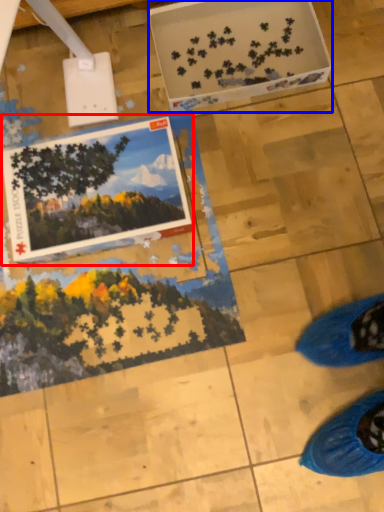
Question: Which object is further to the camera taking this photo, postcard (highlighted by a red box) or cardboard box (highlighted by a blue box)?

Choices:
 (A) postcard
 (B) cardboard box

Answer: (B)